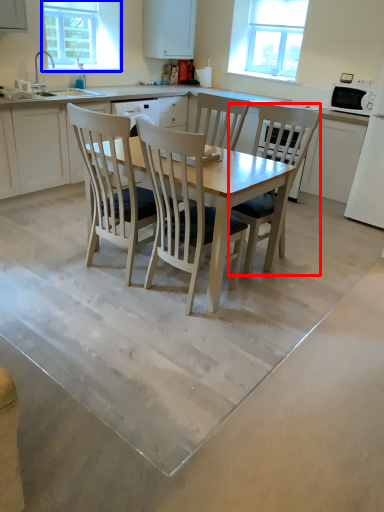
Question: Which of the following is the farthest to the observer, chair (highlighted by a red box) or window screen (highlighted by a blue box)?

Choices:
 (A) chair
 (B) window screen

Answer: (B)